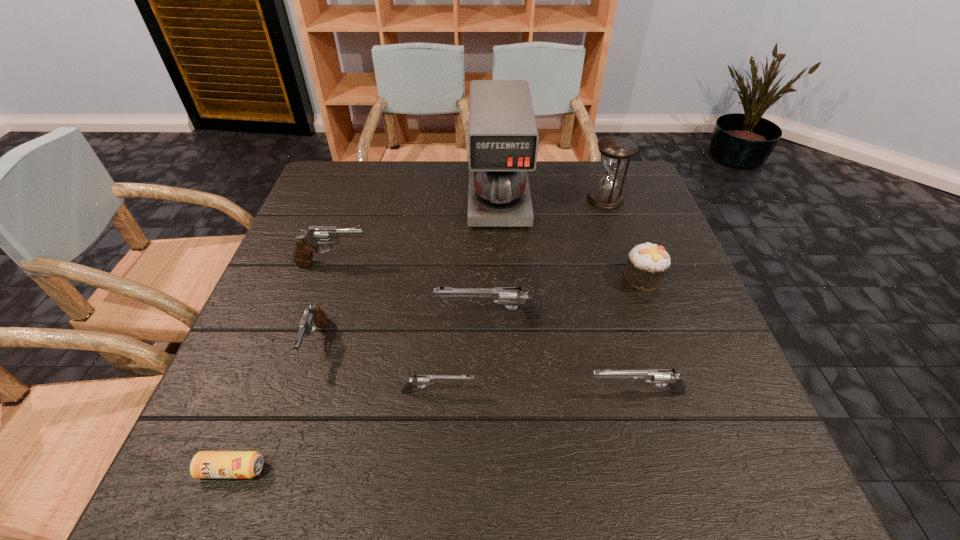
The image size is (960, 540). I want to click on free location located at the barrel of the smaller gray pistol, so click(x=284, y=441).

What are the coordinates of `vacant region located on the front-facing side of the rightmost pistol` in the screenshot? It's located at (436, 393).

The height and width of the screenshot is (540, 960). What are the coordinates of `free space located on the front-facing side of the rightmost pistol` in the screenshot? It's located at (377, 393).

Where is `vacant space located 0.150m on the front-facing side of the rightmost pistol`? vacant space located 0.150m on the front-facing side of the rightmost pistol is located at coordinates (506, 393).

Identify the location of free spot located 0.150m on the front-facing side of the eighth tallest object. The width and height of the screenshot is (960, 540). (555, 392).

I want to click on blank space located on the right of the nearest object, so click(x=478, y=470).

This screenshot has width=960, height=540. I want to click on coffee maker present at the far edge, so click(503, 138).

I want to click on hourglass present at the far edge, so click(x=616, y=150).

Locate an element on the screen. This screenshot has width=960, height=540. object present at the near edge is located at coordinates (205, 464).

In order to click on beer can present at the left edge in this screenshot , I will do `click(205, 464)`.